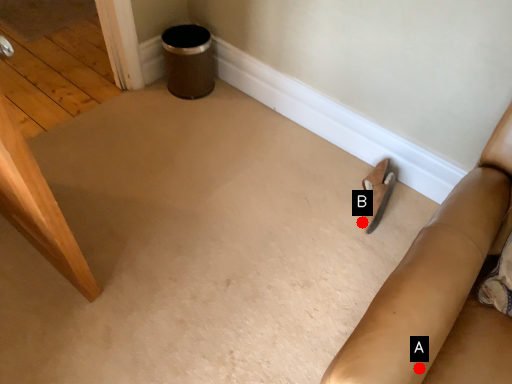
Question: Two points are circled on the image, labeled by A and B beside each circle. Which point is farther to the camera?

Choices:
 (A) A is further
 (B) B is further

Answer: (B)